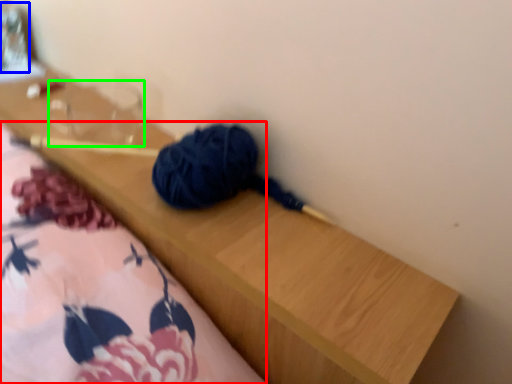
Question: Considering the real-world distances, which object is farthest from blanket (highlighted by a red box)? glass jar (highlighted by a blue box) or clear (highlighted by a green box)?

Choices:
 (A) glass jar
 (B) clear

Answer: (A)